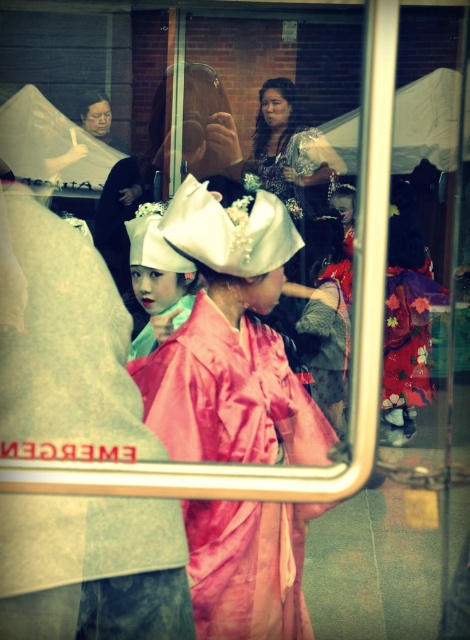
You are standing in front of a reflective surface and see two points marked as point (80, 308) and point (318, 141). Which point is closer to you?

Point (318, 141) is closer to you because it is in front of point (80, 308).

Looking at this image, you are a photographer trying to capture the best shot of the two dresses displayed in the scene. Since the pink satin kimono at center and the matte floral dress at center are both at the center, which one do you think is more likely to be in focus if you focus on the center of the image?

The pink satin kimono at center is taller than the matte floral dress at center, so focusing on the center would likely put the pink satin kimono at center in focus as it occupies a larger portion of the central area.